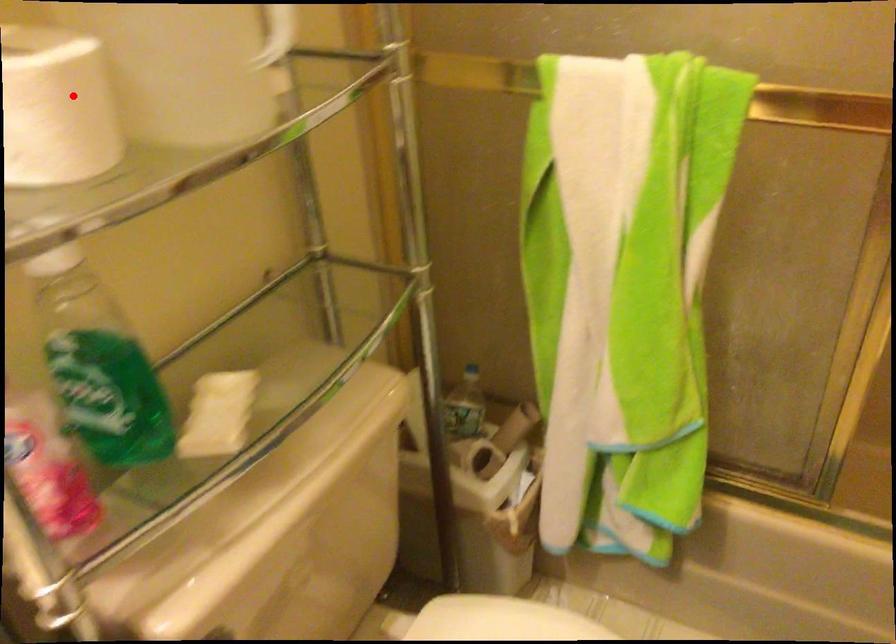
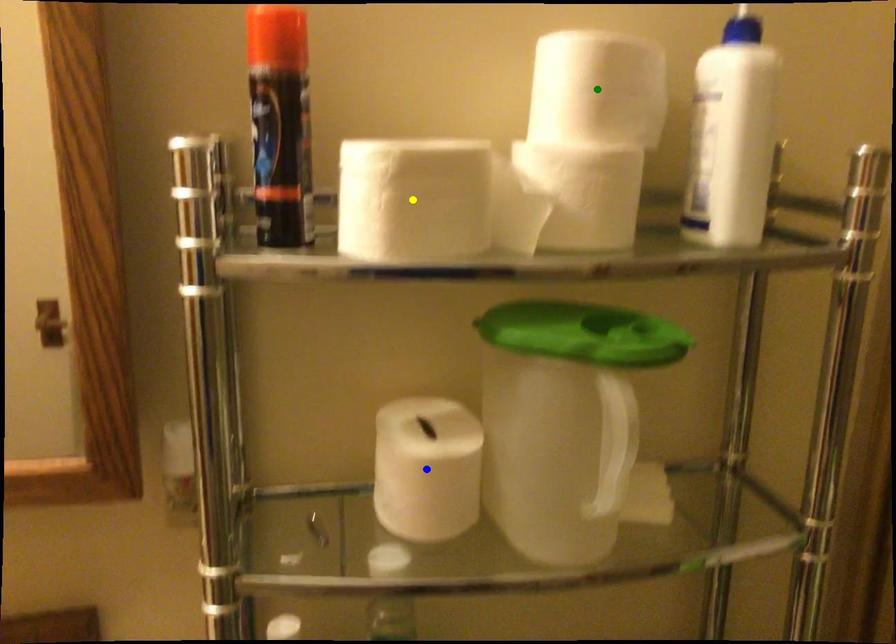
Question: I am providing you with two images of the same scene from different viewpoints. A red point is marked on the first image. You are given multiple points on the second image. In image 2, which mark is for the same physical point as the one in image 1?

Choices:
 (A) yellow point
 (B) blue point
 (C) green point

Answer: (B)